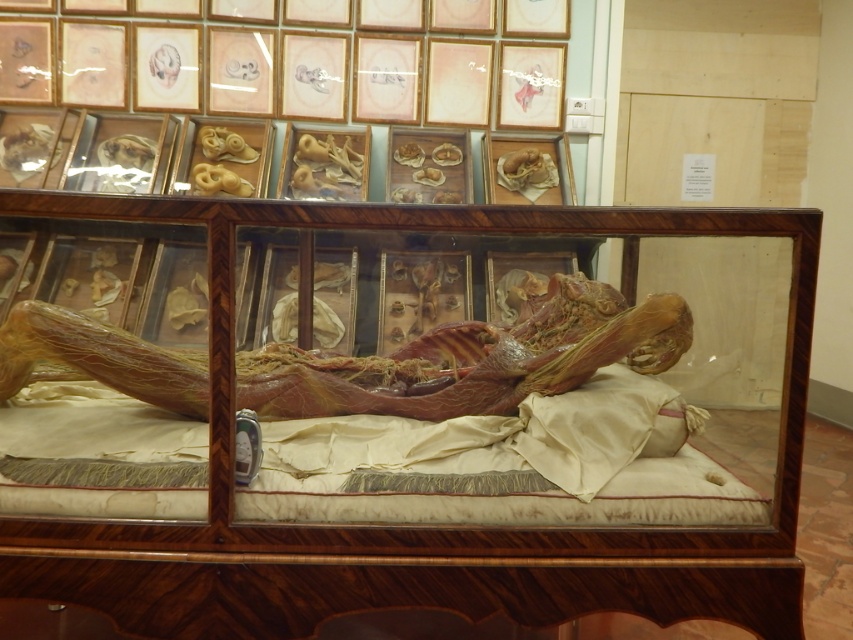
Between point (38, 497) and point (518, 326), which one is positioned in front?

Point (38, 497)

Does point (223, 275) come closer to viewer compared to point (635, 346)?

Yes.

The width and height of the screenshot is (853, 640). Find the location of `transparent wood glass box at center`. transparent wood glass box at center is located at coordinates (403, 413).